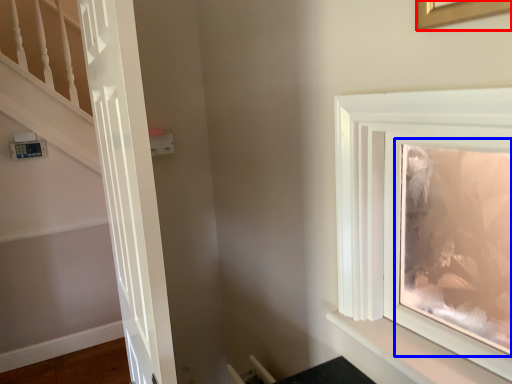
Question: Among these objects, which one is nearest to the camera, picture frame (highlighted by a red box) or picture frame (highlighted by a blue box)?

Choices:
 (A) picture frame
 (B) picture frame

Answer: (A)